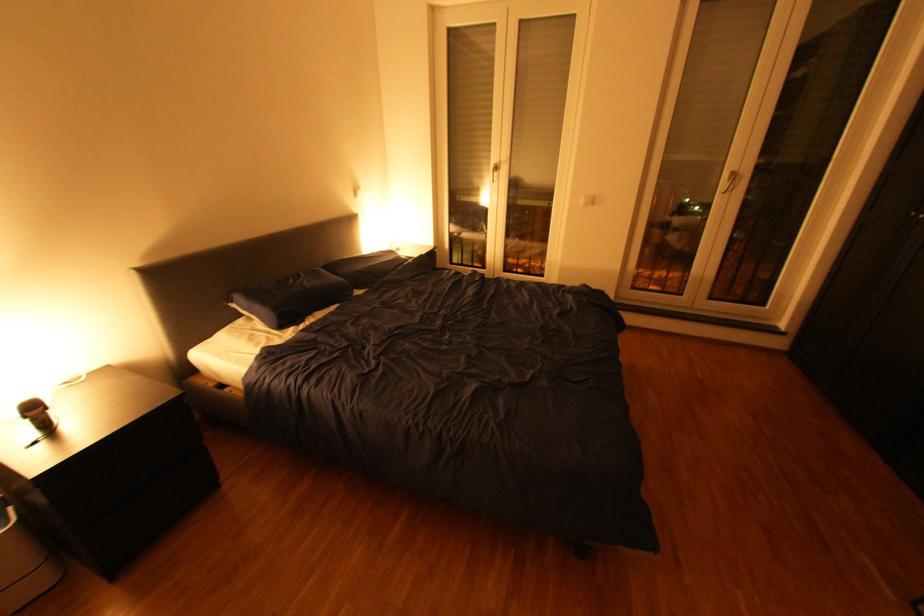
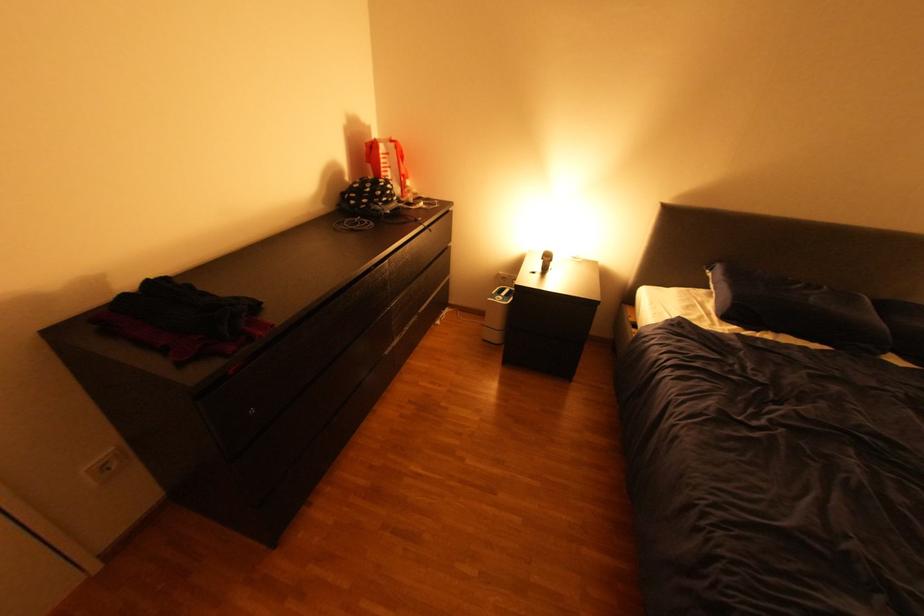
Find the pixel in the second image that matches [56,411] in the first image.

(561, 262)